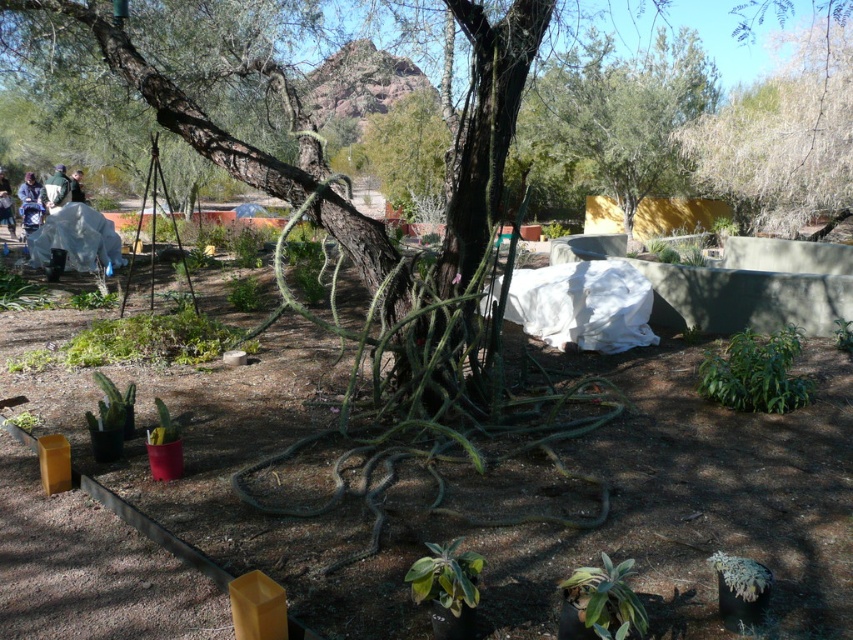
You are standing in a garden and want to take a photo of the white textured tree at upper right. If your camera has a maximum zoom range of 15 meters, will you be able to capture the tree clearly without moving closer?

The white textured tree at upper right is 16.32 meters away from the viewer. Since the camera can only zoom up to 15 meters, you won cannot capture it clearly without moving closer.

You are a gardener who needs to place a light blue denim jacket at upper left on a hanger that can only hold items shorter than the white textured tree at upper right. Can the jacket be placed there?

The white textured tree at upper right is taller than the light blue denim jacket at upper left, so the jacket can be placed on the hanger since it is shorter than the tree.